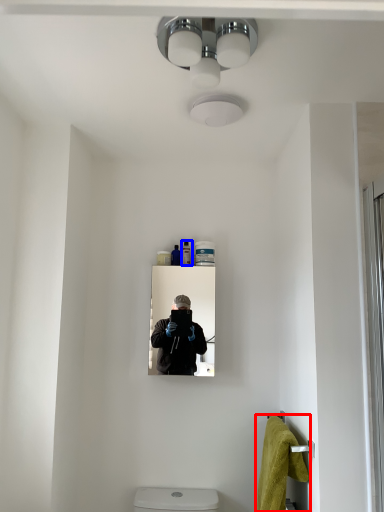
Question: Which object is further to the camera taking this photo, bath towel (highlighted by a red box) or toiletry (highlighted by a blue box)?

Choices:
 (A) bath towel
 (B) toiletry

Answer: (B)